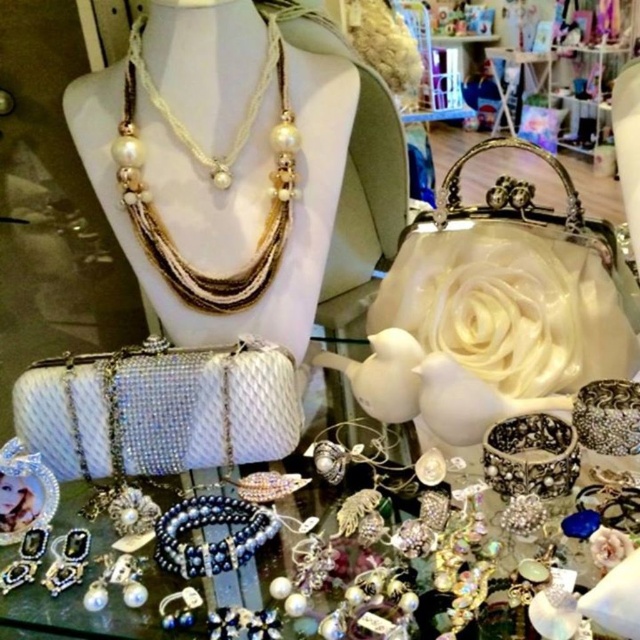
You are a customer in a jewelry store and want to examine two points on the display. The first point is at coordinate point (209,497) and the second is at point (145,83). Which point is closer to you?

Point (209,497) is closer to the viewer than point (145,83).